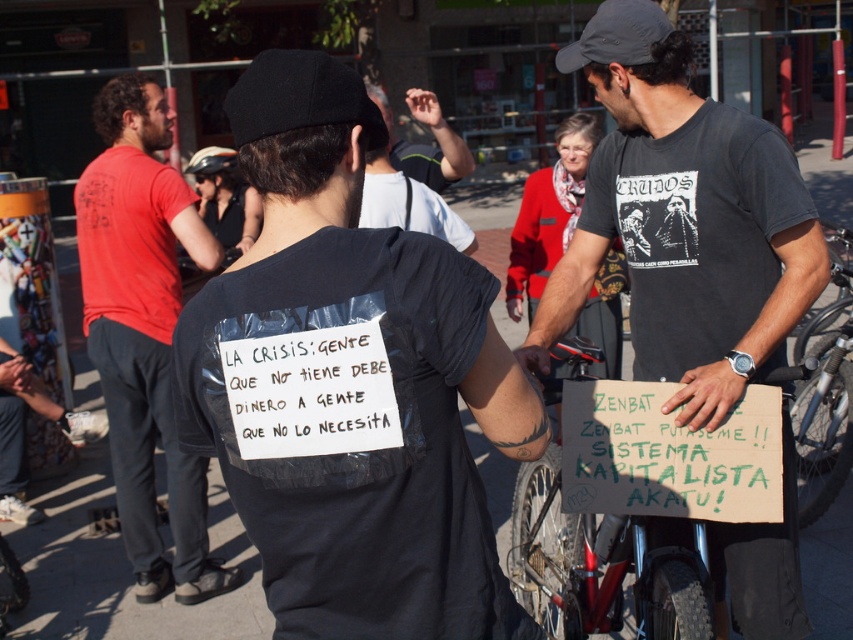
Question: Which of these objects is positioned closest to the matte black shirt at left?

Choices:
 (A) black fabric baseball cap at upper center
 (B) dark gray t-shirt at center

Answer: (B)

Question: Is dark gray t-shirt at center in front of matte black shirt at left?

Choices:
 (A) yes
 (B) no

Answer: (A)

Question: Can you confirm if matte black shirt at left is thinner than metallic silver bicycle at center?

Choices:
 (A) no
 (B) yes

Answer: (A)

Question: Observing the image, what is the correct spatial positioning of dark gray t-shirt at center in reference to metallic silver bicycle at center?

Choices:
 (A) above
 (B) below

Answer: (A)

Question: Among these objects, which one is farthest from the camera?

Choices:
 (A) matte black shirt at left
 (B) dark gray t-shirt at center
 (C) black fabric baseball cap at upper center
 (D) metallic silver bicycle at center

Answer: (A)

Question: Which point is closer to the camera taking this photo?

Choices:
 (A) (589, 182)
 (B) (703, 556)
 (C) (170, 202)
 (D) (254, 70)

Answer: (D)